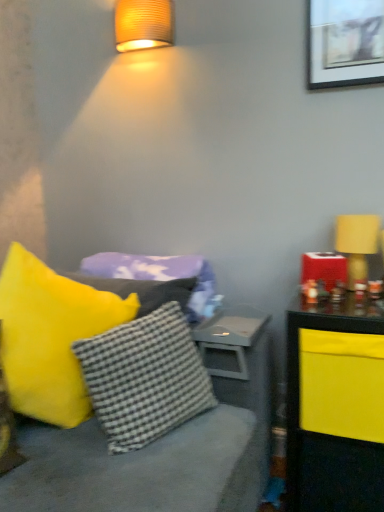
At what (x,y) coordinates should I click in order to perform the action: click on checkered fabric pillow at center, which is the 2th pillow in front-to-back order. Please return your answer as a coordinate pair (x, y). This screenshot has width=384, height=512. Looking at the image, I should click on (144, 378).

I want to click on yellow fabric lampshade at right, so click(357, 244).

At what (x,y) coordinates should I click in order to perform the action: click on checkered fabric pillow at center, which is the 2th pillow in front-to-back order. Please return your answer as a coordinate pair (x, y). Looking at the image, I should click on (144, 378).

This screenshot has height=512, width=384. What are the coordinates of `picture frame in front of the yellow fabric lampshade at right` in the screenshot? It's located at (345, 42).

Does point (361, 248) lie in front of point (321, 70)?

Yes.

Considering the relative positions of yellow fabric lampshade at right and matte white picture frame at upper right in the image provided, is yellow fabric lampshade at right in front of matte white picture frame at upper right?

No, the depth of yellow fabric lampshade at right is greater than that of matte white picture frame at upper right.

Does yellow fabric lampshade at right have a smaller size compared to matte white picture frame at upper right?

No.

Which object is further away from the camera taking this photo, matte white picture frame at upper right or matte ribbed lampshade at upper left?

Positioned behind is matte ribbed lampshade at upper left.

From the image's perspective, would you say matte white picture frame at upper right is positioned over matte ribbed lampshade at upper left?

Incorrect, from the image's perspective, matte white picture frame at upper right is lower than matte ribbed lampshade at upper left.

Which object is wider, matte white picture frame at upper right or matte ribbed lampshade at upper left?

With larger width is matte ribbed lampshade at upper left.

Is point (355, 265) closer to viewer compared to point (120, 50)?

Yes, point (355, 265) is closer to viewer.

Which is correct: yellow fabric lampshade at right is inside matte ribbed lampshade at upper left, or outside of it?

yellow fabric lampshade at right is spatially situated outside matte ribbed lampshade at upper left.

From a real-world perspective, which is physically below, yellow fabric lampshade at right or matte ribbed lampshade at upper left?

yellow fabric lampshade at right is physically lower.

How many degrees apart are the facing directions of yellow fabric lampshade at right and matte ribbed lampshade at upper left?

They differ by 0.387 degrees in their facing directions.

You are a GUI agent. You are given a task and a screenshot of the screen. Output one action in this format:
    pyautogui.click(x=<x>, y=<y>)
    Task: Click on the table directly beneath the matte white picture frame at upper right (from a real-world perspective)
    This screenshot has width=384, height=512.
    Given the screenshot: What is the action you would take?
    pyautogui.click(x=230, y=339)

Which of these two, matte white picture frame at upper right or gray matte table at center, stands taller?

matte white picture frame at upper right.

Do you think matte white picture frame at upper right is within gray matte table at center, or outside of it?

matte white picture frame at upper right lies outside gray matte table at center.

Is matte white picture frame at upper right aimed at soft purple pillow at center, placed as the first pillow when sorted from back to front?

No, matte white picture frame at upper right is not oriented towards soft purple pillow at center, placed as the first pillow when sorted from back to front.

Is matte white picture frame at upper right thinner than soft purple pillow at center, the 3th pillow from the front?

Correct, the width of matte white picture frame at upper right is less than that of soft purple pillow at center, the 3th pillow from the front.

Considering the positions of objects matte white picture frame at upper right and soft purple pillow at center, the 3th pillow from the front, in the image provided, who is more to the right, matte white picture frame at upper right or soft purple pillow at center, the 3th pillow from the front,?

matte white picture frame at upper right.

Is matte white picture frame at upper right far away from soft purple pillow at center, the 3th pillow from the front?

Actually, matte white picture frame at upper right and soft purple pillow at center, the 3th pillow from the front, are a little close together.

Is matte white picture frame at upper right taller than yellow fabric lampshade at right?

Yes.

Which object is wider, matte white picture frame at upper right or yellow fabric lampshade at right?

yellow fabric lampshade at right.

From a real-world perspective, is matte white picture frame at upper right over yellow fabric lampshade at right?

Yes, from a real-world perspective, matte white picture frame at upper right is on top of yellow fabric lampshade at right.

Are matte white picture frame at upper right and yellow fabric lampshade at right far apart?

matte white picture frame at upper right is actually quite close to yellow fabric lampshade at right.

Considering the sizes of objects checkered fabric pillow at center, which is the 2th pillow in front-to-back order, and matte ribbed lampshade at upper left in the image provided, who is wider, checkered fabric pillow at center, which is the 2th pillow in front-to-back order, or matte ribbed lampshade at upper left?

checkered fabric pillow at center, which is the 2th pillow in front-to-back order.

From a real-world perspective, is checkered fabric pillow at center, which is the 2th pillow in front-to-back order, located beneath matte ribbed lampshade at upper left?

Yes, from a real-world perspective, checkered fabric pillow at center, which is the 2th pillow in front-to-back order, is beneath matte ribbed lampshade at upper left.

Does checkered fabric pillow at center, which ranks as the 2th pillow in back-to-front order, contain matte ribbed lampshade at upper left?

No, matte ribbed lampshade at upper left is located outside of checkered fabric pillow at center, which ranks as the 2th pillow in back-to-front order.

Is checkered fabric pillow at center, which is the 2th pillow in front-to-back order, beside matte ribbed lampshade at upper left?

No, checkered fabric pillow at center, which is the 2th pillow in front-to-back order, is not next to matte ribbed lampshade at upper left.

I want to click on picture frame above the yellow fabric lampshade at right (from a real-world perspective), so click(x=345, y=42).

Where is `lamp that is on the left side of matte white picture frame at upper right`? The height and width of the screenshot is (512, 384). lamp that is on the left side of matte white picture frame at upper right is located at coordinates (143, 24).

Which object lies nearer to the anchor point yellow fabric lampshade at right, checkered fabric pillow at center, which ranks as the 2th pillow in back-to-front order, or yellow fabric pillow at left, which is the first pillow from front to back?

The object closer to yellow fabric lampshade at right is checkered fabric pillow at center, which ranks as the 2th pillow in back-to-front order.

Considering their positions, is yellow fabric lampshade at right positioned closer to soft purple pillow at center, the 3th pillow from the front, than yellow fabric pillow at left, which is the first pillow from front to back?

Among the two, yellow fabric pillow at left, which is the first pillow from front to back, is located nearer to soft purple pillow at center, the 3th pillow from the front.

When comparing their distances from yellow fabric pillow at left, which is the first pillow from front to back, does matte white picture frame at upper right or yellow fabric lampshade at right seem further?

Based on the image, matte white picture frame at upper right appears to be further to yellow fabric pillow at left, which is the first pillow from front to back.

Which object lies nearer to the anchor point checkered fabric pillow at center, which ranks as the 2th pillow in back-to-front order, yellow fabric pillow at left, which is the first pillow from front to back, or matte ribbed lampshade at upper left?

yellow fabric pillow at left, which is the first pillow from front to back, is positioned closer to the anchor checkered fabric pillow at center, which ranks as the 2th pillow in back-to-front order.

Considering their positions, is yellow fabric lampshade at right positioned closer to gray matte table at center than matte ribbed lampshade at upper left?

The object closer to gray matte table at center is yellow fabric lampshade at right.

Which object lies nearer to the anchor point yellow fabric lampshade at right, matte ribbed lampshade at upper left or soft purple pillow at center, placed as the first pillow when sorted from back to front?

soft purple pillow at center, placed as the first pillow when sorted from back to front.

When comparing their distances from soft purple pillow at center, the 3th pillow from the front, does yellow fabric pillow at left, which is counted as the 3th pillow, starting from the back, or checkered fabric pillow at center, which is the 2th pillow in front-to-back order, seem further?

The object further to soft purple pillow at center, the 3th pillow from the front, is checkered fabric pillow at center, which is the 2th pillow in front-to-back order.

Based on their spatial positions, is gray matte table at center or matte ribbed lampshade at upper left further from matte white picture frame at upper right?

gray matte table at center lies further to matte white picture frame at upper right than the other object.

Where is `picture frame between matte ribbed lampshade at upper left and checkered fabric pillow at center, which ranks as the 2th pillow in back-to-front order, in the vertical direction`? The height and width of the screenshot is (512, 384). picture frame between matte ribbed lampshade at upper left and checkered fabric pillow at center, which ranks as the 2th pillow in back-to-front order, in the vertical direction is located at coordinates (345, 42).

This screenshot has width=384, height=512. What are the coordinates of `table lamp between matte white picture frame at upper right and soft purple pillow at center, placed as the first pillow when sorted from back to front, in the vertical direction` in the screenshot? It's located at (357, 244).

Where is `picture frame between matte ribbed lampshade at upper left and gray matte table at center from top to bottom`? This screenshot has height=512, width=384. picture frame between matte ribbed lampshade at upper left and gray matte table at center from top to bottom is located at coordinates (345, 42).

In order to click on pillow between yellow fabric pillow at left, which is the first pillow from front to back, and soft purple pillow at center, the 3th pillow from the front, from front to back in this screenshot , I will do `click(144, 378)`.